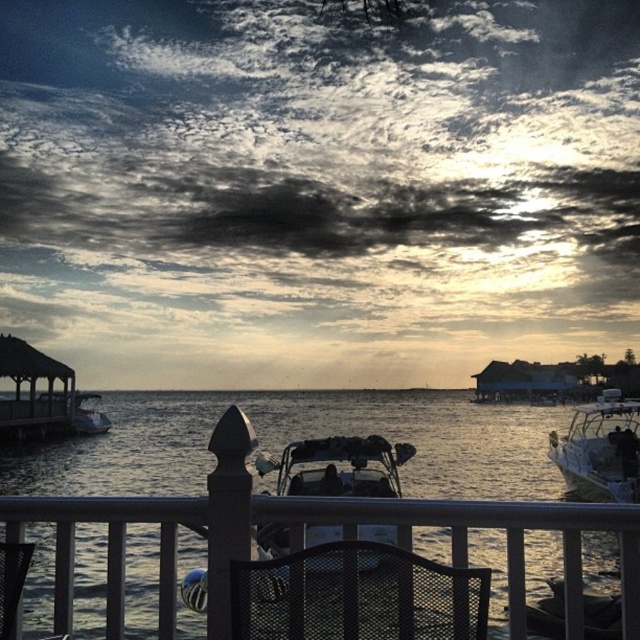
You are planning to rent a boat for a short trip. You see the shiny black motorboat at center and the white glossy boat at right. Which one would you choose if you want a larger vessel?

The shiny black motorboat at center is bigger than the white glossy boat at right, so you should choose the shiny black motorboat at center for a larger vessel.

You are standing on a dock and want to know if the translucent water at center is higher or lower than the shiny black motorboat at center. Based on the scene, can you determine which one is taller?

The translucent water at center is much taller than the shiny black motorboat at center according to the description.